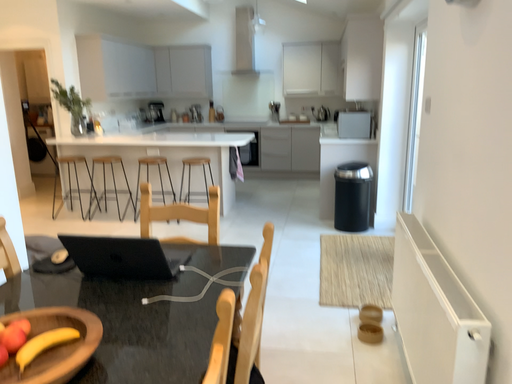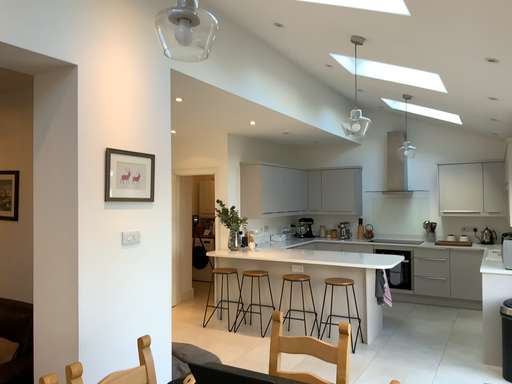
Question: How did the camera likely rotate when shooting the video?

Choices:
 (A) rotated upward
 (B) rotated downward

Answer: (A)